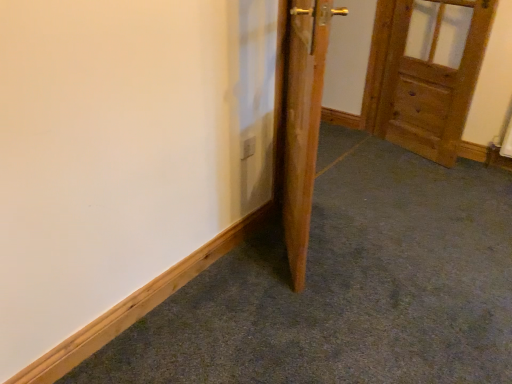
Locate an element on the screen. Image resolution: width=512 pixels, height=384 pixels. wooden door at center, which appears as the 1th door when viewed from the front is located at coordinates (x=303, y=123).

What do you see at coordinates (303, 123) in the screenshot? This screenshot has width=512, height=384. I see `wooden door at center, which is the second door from right to left` at bounding box center [303, 123].

Find the location of a particular element. The height and width of the screenshot is (384, 512). wooden door at upper right, the 1th door from the right is located at coordinates (426, 76).

Image resolution: width=512 pixels, height=384 pixels. Describe the element at coordinates (426, 76) in the screenshot. I see `wooden door at upper right, acting as the second door starting from the front` at that location.

At what (x,y) coordinates should I click in order to perform the action: click on wooden door at center, which appears as the 1th door when viewed from the front. Please return your answer as a coordinate pair (x, y). Looking at the image, I should click on (303, 123).

Can you confirm if wooden door at upper right, acting as the second door starting from the front, is positioned to the right of wooden door at center, which is the second door from right to left?

Indeed, wooden door at upper right, acting as the second door starting from the front, is positioned on the right side of wooden door at center, which is the second door from right to left.

Which is in front, wooden door at upper right, the 1th door viewed from the back, or wooden door at center, which is the second door from right to left?

Positioned in front is wooden door at center, which is the second door from right to left.

Which is behind, point (453, 87) or point (303, 123)?

The point (453, 87) is more distant.

From the image's perspective, which is below, wooden door at upper right, which ranks as the 2th door in left-to-right order, or wooden door at center, which is the second door from right to left?

From the image's view, wooden door at center, which is the second door from right to left, is below.

Looking at this image, from a real-world perspective, which is physically below, wooden door at upper right, acting as the second door starting from the front, or wooden door at center, which is the second door from right to left?

From a 3D spatial view, wooden door at upper right, acting as the second door starting from the front, is below.

Which object is wider, wooden door at upper right, acting as the second door starting from the front, or wooden door at center, which is the second door from right to left?

wooden door at center, which is the second door from right to left, is wider.

Between wooden door at upper right, which ranks as the 2th door in left-to-right order, and wooden door at center, which is the 1th door in left-to-right order, which one has less height?

With less height is wooden door at upper right, which ranks as the 2th door in left-to-right order.

Who is bigger, wooden door at upper right, acting as the second door starting from the front, or wooden door at center, which is the second door from right to left?

Bigger between the two is wooden door at center, which is the second door from right to left.

Consider the image. Does wooden door at upper right, acting as the second door starting from the front, contain wooden door at center, which is the second door from right to left?

No, wooden door at center, which is the second door from right to left, is located outside of wooden door at upper right, acting as the second door starting from the front.

Based on the photo, is wooden door at upper right, acting as the second door starting from the front, in contact with wooden door at center, which appears as the 1th door when viewed from the front?

There is a gap between wooden door at upper right, acting as the second door starting from the front, and wooden door at center, which appears as the 1th door when viewed from the front.

Could you tell me if wooden door at upper right, the 1th door viewed from the back, is facing wooden door at center, which is the second door from right to left?

Yes, wooden door at upper right, the 1th door viewed from the back, is facing wooden door at center, which is the second door from right to left.

You are a GUI agent. You are given a task and a screenshot of the screen. Output one action in this format:
    pyautogui.click(x=<x>, y=<y>)
    Task: Click on the door located in front of the wooden door at upper right, the 1th door from the right
    This screenshot has width=512, height=384.
    Given the screenshot: What is the action you would take?
    pyautogui.click(x=303, y=123)

Considering the positions of objects wooden door at center, acting as the 2th door starting from the back, and wooden door at upper right, the 1th door from the right, in the image provided, who is more to the left, wooden door at center, acting as the 2th door starting from the back, or wooden door at upper right, the 1th door from the right,?

From the viewer's perspective, wooden door at center, acting as the 2th door starting from the back, appears more on the left side.

Between wooden door at center, which appears as the 1th door when viewed from the front, and wooden door at upper right, acting as the second door starting from the front, which one is positioned behind?

wooden door at upper right, acting as the second door starting from the front.

Does point (310, 70) appear closer or farther from the camera than point (475, 53)?

Point (310, 70) is positioned closer to the camera compared to point (475, 53).

From the image's perspective, is wooden door at center, which appears as the 1th door when viewed from the front, located above or below wooden door at upper right, acting as the second door starting from the front?

wooden door at center, which appears as the 1th door when viewed from the front, is situated lower than wooden door at upper right, acting as the second door starting from the front, in the image.

From a real-world perspective, who is located lower, wooden door at center, acting as the 2th door starting from the back, or wooden door at upper right, the 1th door viewed from the back?

From a 3D spatial view, wooden door at upper right, the 1th door viewed from the back, is below.

Consider the image. Which object is wider, wooden door at center, acting as the 2th door starting from the back, or wooden door at upper right, which ranks as the 2th door in left-to-right order?

With larger width is wooden door at center, acting as the 2th door starting from the back.

Which of these two, wooden door at center, acting as the 2th door starting from the back, or wooden door at upper right, acting as the second door starting from the front, stands taller?

Standing taller between the two is wooden door at center, acting as the 2th door starting from the back.

Considering the relative sizes of wooden door at center, acting as the 2th door starting from the back, and wooden door at upper right, the 1th door viewed from the back, in the image provided, is wooden door at center, acting as the 2th door starting from the back, bigger than wooden door at upper right, the 1th door viewed from the back,?

Yes, wooden door at center, acting as the 2th door starting from the back, is bigger than wooden door at upper right, the 1th door viewed from the back.

Is wooden door at center, which is the second door from right to left, not inside wooden door at upper right, which ranks as the 2th door in left-to-right order?

Yes, wooden door at center, which is the second door from right to left, is outside of wooden door at upper right, which ranks as the 2th door in left-to-right order.

Is wooden door at center, which is the second door from right to left, not close to wooden door at upper right, which ranks as the 2th door in left-to-right order?

Yes, wooden door at center, which is the second door from right to left, is far from wooden door at upper right, which ranks as the 2th door in left-to-right order.

Is wooden door at center, which is the 1th door in left-to-right order, facing away from wooden door at upper right, the 1th door from the right?

No.

You are a GUI agent. You are given a task and a screenshot of the screen. Output one action in this format:
    pyautogui.click(x=<x>, y=<y>)
    Task: Click on the door that appears behind the wooden door at center, acting as the 2th door starting from the back
    This screenshot has height=384, width=512.
    Given the screenshot: What is the action you would take?
    pyautogui.click(x=426, y=76)

Find the location of a particular element. The image size is (512, 384). door below the wooden door at upper right, acting as the second door starting from the front (from the image's perspective) is located at coordinates (303, 123).

Locate an element on the screen. The image size is (512, 384). door that is above the wooden door at center, which appears as the 1th door when viewed from the front (from the image's perspective) is located at coordinates (426, 76).